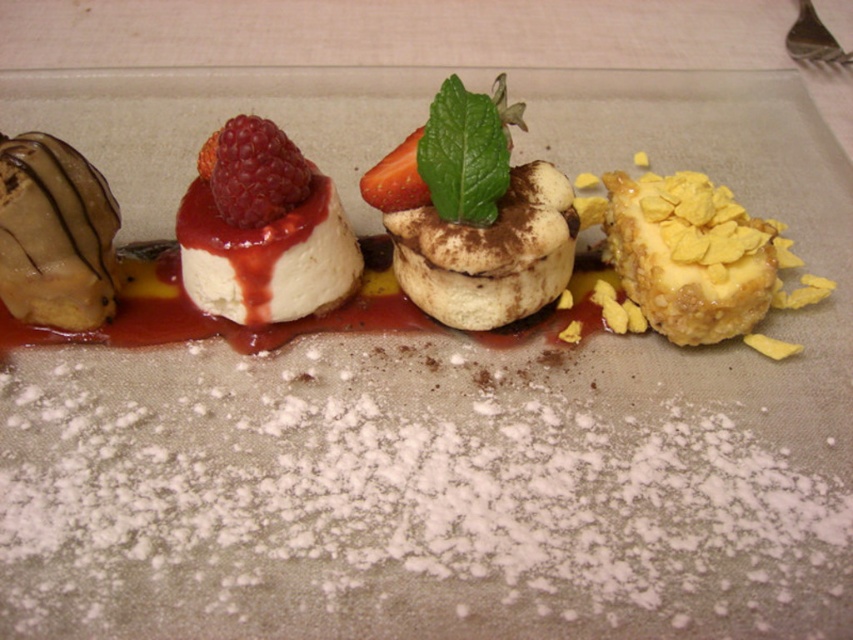
Is raspberry at center closer to the viewer compared to red matte strawberry at center?

That is True.

Who is positioned more to the left, raspberry at center or red matte strawberry at center?

raspberry at center is more to the left.

The width and height of the screenshot is (853, 640). Describe the element at coordinates (253, 172) in the screenshot. I see `raspberry at center` at that location.

You are a GUI agent. You are given a task and a screenshot of the screen. Output one action in this format:
    pyautogui.click(x=<x>, y=<y>)
    Task: Click on the raspberry at center
    
    Given the screenshot: What is the action you would take?
    pyautogui.click(x=253, y=172)

Describe the element at coordinates (489, 253) in the screenshot. I see `cinnamon-sprinkled pastry at center` at that location.

From the picture: Is cinnamon-sprinkled pastry at center bigger than yellow crumbly pastry at right?

Yes, cinnamon-sprinkled pastry at center is bigger than yellow crumbly pastry at right.

Is point (502, 228) farther from viewer compared to point (666, 321)?

No.

Where is `cinnamon-sprinkled pastry at center`? cinnamon-sprinkled pastry at center is located at coordinates (489, 253).

Find the location of a particular element. chocolate-dipped ice cream at left is located at coordinates (55, 234).

Does chocolate-dipped ice cream at left appear under raspberry at center?

Yes, chocolate-dipped ice cream at left is below raspberry at center.

Is point (24, 243) behind point (254, 145)?

Yes, point (24, 243) is behind point (254, 145).

This screenshot has height=640, width=853. Identify the location of chocolate-dipped ice cream at left. (55, 234).